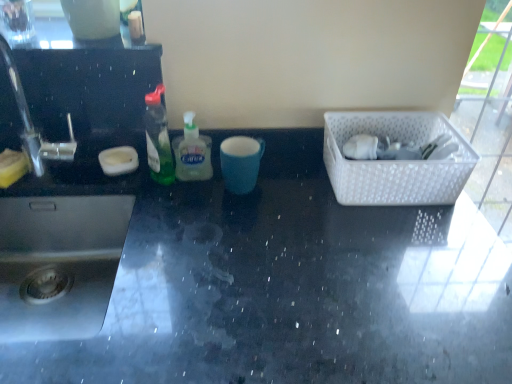
Question: Is translucent green liquid soap at center, marked as the first bottle in a right-to-left arrangement, taller than white plastic basket at right?

Choices:
 (A) no
 (B) yes

Answer: (B)

Question: From a real-world perspective, is translucent green liquid soap at center, marked as the second bottle in a left-to-right arrangement, located beneath white plastic basket at right?

Choices:
 (A) no
 (B) yes

Answer: (A)

Question: Is translucent green liquid soap at center, marked as the second bottle in a left-to-right arrangement, oriented towards white plastic basket at right?

Choices:
 (A) yes
 (B) no

Answer: (B)

Question: Can you confirm if translucent green liquid soap at center, marked as the first bottle in a right-to-left arrangement, is thinner than white plastic basket at right?

Choices:
 (A) no
 (B) yes

Answer: (B)

Question: Is translucent green liquid soap at center, marked as the first bottle in a right-to-left arrangement, outside white plastic basket at right?

Choices:
 (A) no
 (B) yes

Answer: (B)

Question: Looking at their shapes, would you say white plastic basket at right is wider or thinner than green translucent bottle at center, placed as the first bottle when sorted from left to right?

Choices:
 (A) thin
 (B) wide

Answer: (B)

Question: From a real-world perspective, relative to green translucent bottle at center, placed as the first bottle when sorted from left to right, is white plastic basket at right vertically above or below?

Choices:
 (A) above
 (B) below

Answer: (B)

Question: In terms of size, does white plastic basket at right appear bigger or smaller than green translucent bottle at center, placed as the first bottle when sorted from left to right?

Choices:
 (A) big
 (B) small

Answer: (A)

Question: Is point (457, 170) positioned closer to the camera than point (165, 140)?

Choices:
 (A) closer
 (B) farther

Answer: (A)

Question: In terms of width, does white plastic basket at right look wider or thinner when compared to translucent green liquid soap at center, marked as the first bottle in a right-to-left arrangement?

Choices:
 (A) wide
 (B) thin

Answer: (A)

Question: From their relative heights in the image, would you say white plastic basket at right is taller or shorter than translucent green liquid soap at center, marked as the second bottle in a left-to-right arrangement?

Choices:
 (A) short
 (B) tall

Answer: (A)

Question: From the image's perspective, is white plastic basket at right positioned above or below translucent green liquid soap at center, marked as the second bottle in a left-to-right arrangement?

Choices:
 (A) above
 (B) below

Answer: (B)

Question: In the image, is white plastic basket at right on the left side or the right side of translucent green liquid soap at center, marked as the second bottle in a left-to-right arrangement?

Choices:
 (A) right
 (B) left

Answer: (A)

Question: In terms of height, does black glossy countertop at center look taller or shorter compared to white plastic basket at right?

Choices:
 (A) short
 (B) tall

Answer: (B)

Question: Considering the positions of black glossy countertop at center and white plastic basket at right in the image, is black glossy countertop at center bigger or smaller than white plastic basket at right?

Choices:
 (A) big
 (B) small

Answer: (A)